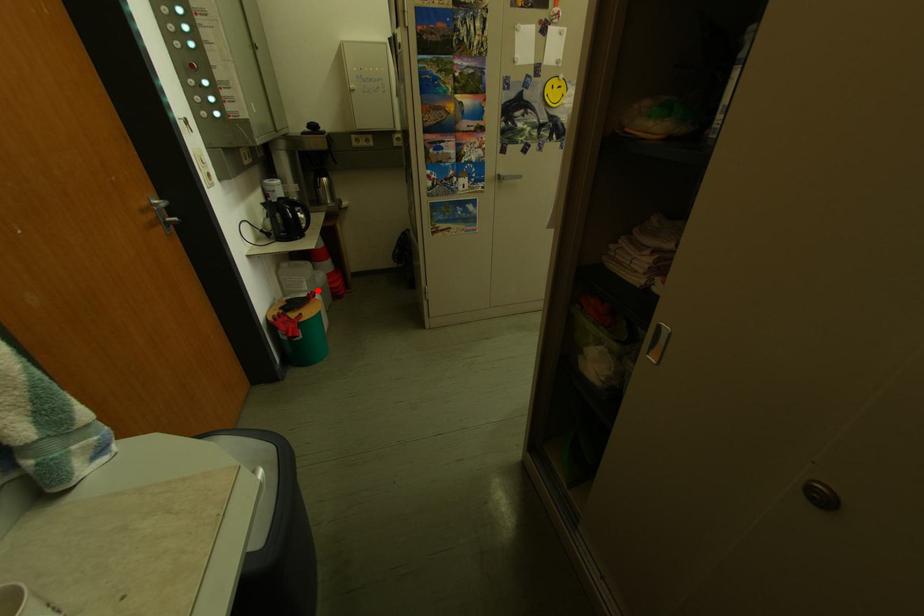
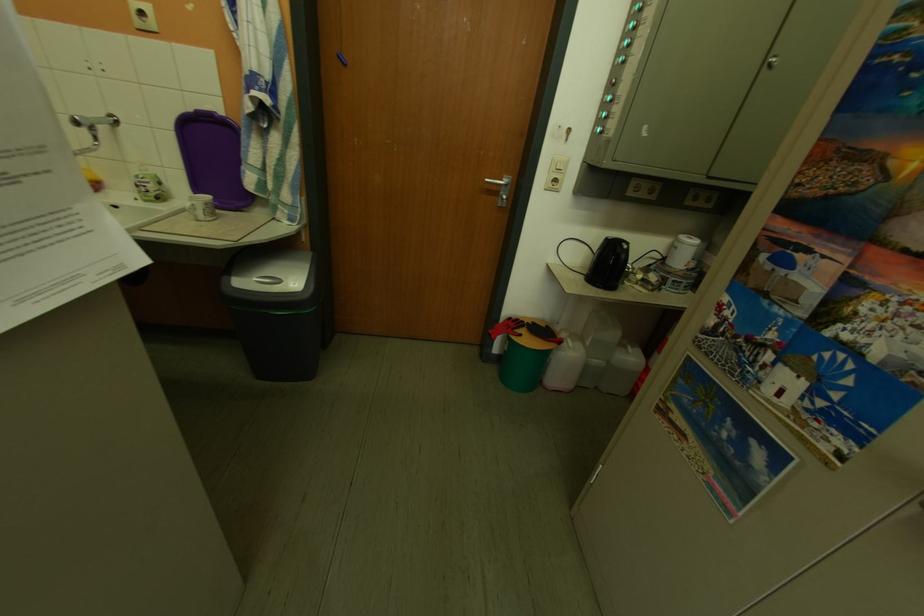
Question: I am providing you with two images of the same scene from different viewpoints. Given a red point in image1, look at the same physical point in image2. Is it:

Choices:
 (A) Closer to the viewpoint
 (B) Farther from the viewpoint

Answer: (B)